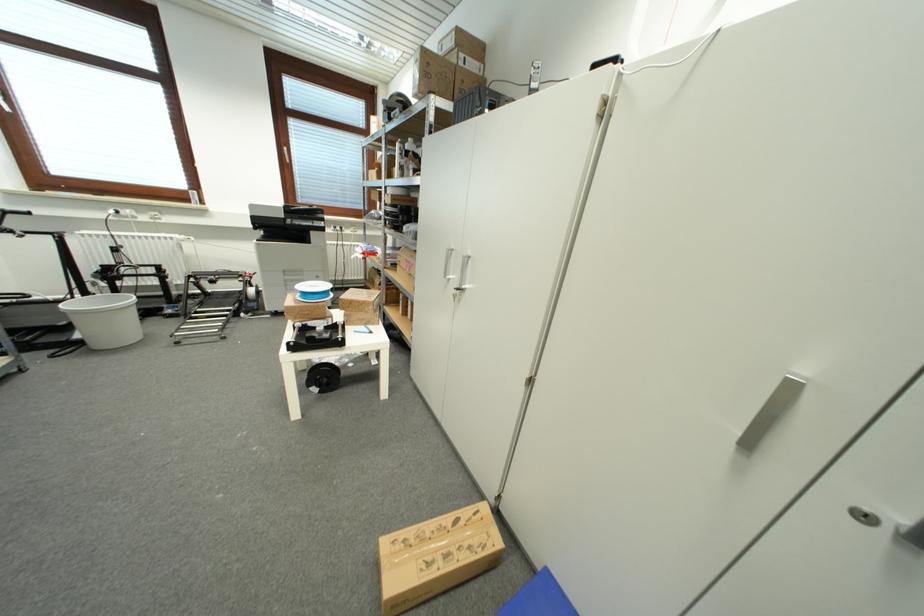
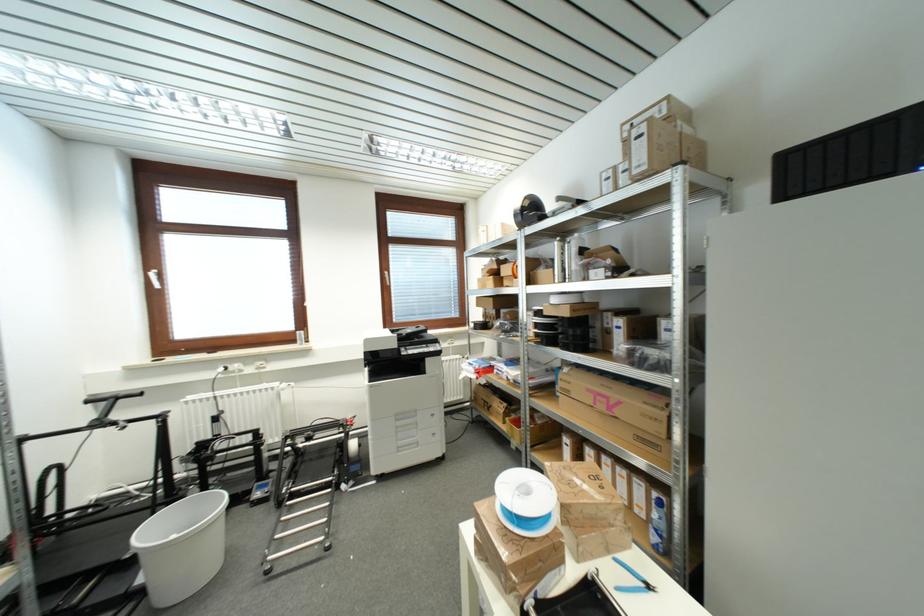
The point at (292, 280) is marked in the first image. Where is the corresponding point in the second image?

(404, 426)